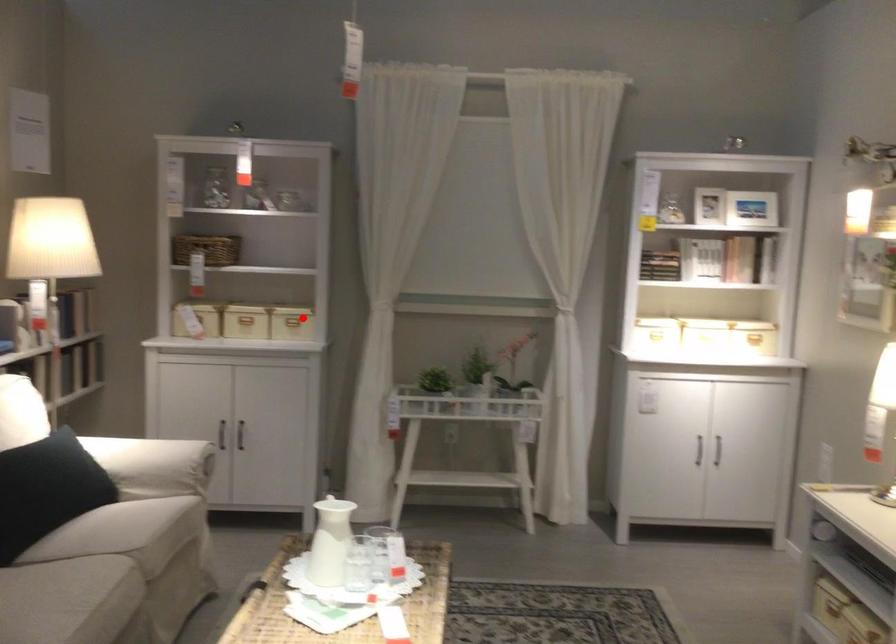
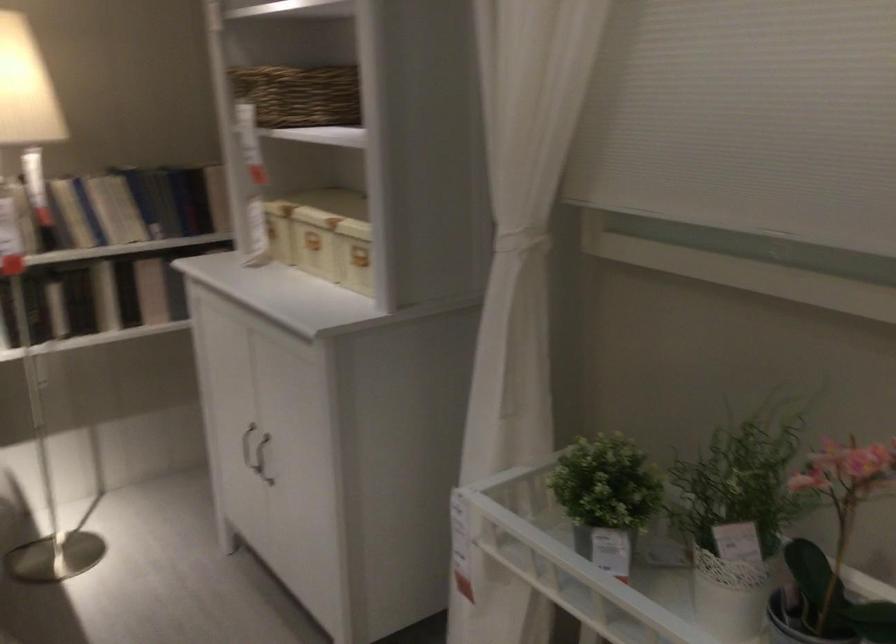
Find the pixel in the second image that matches the highlighted location in the first image.

(354, 254)